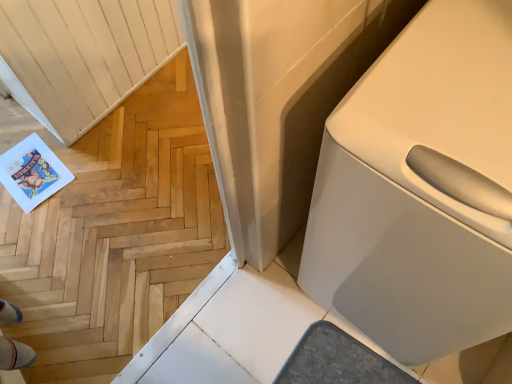
Question: Is white glossy toilet at right spatially inside natural wood floor at lower left, or outside of it?

Choices:
 (A) outside
 (B) inside

Answer: (A)

Question: Considering their positions, is white glossy toilet at right located in front of or behind natural wood floor at lower left?

Choices:
 (A) front
 (B) behind

Answer: (B)

Question: Based on their sizes in the image, would you say white glossy toilet at right is bigger or smaller than natural wood floor at lower left?

Choices:
 (A) big
 (B) small

Answer: (A)

Question: From the image's perspective, is natural wood floor at lower left located above or below white glossy toilet at right?

Choices:
 (A) below
 (B) above

Answer: (A)

Question: In terms of height, does natural wood floor at lower left look taller or shorter compared to white glossy toilet at right?

Choices:
 (A) tall
 (B) short

Answer: (A)

Question: Looking at their shapes, would you say natural wood floor at lower left is wider or thinner than white glossy toilet at right?

Choices:
 (A) wide
 (B) thin

Answer: (B)

Question: Which is correct: natural wood floor at lower left is inside white glossy toilet at right, or outside of it?

Choices:
 (A) outside
 (B) inside

Answer: (A)